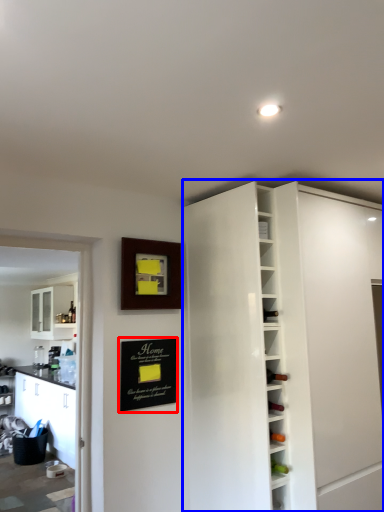
Question: Among these objects, which one is nearest to the camera, bulletin board (highlighted by a red box) or cabinetry (highlighted by a blue box)?

Choices:
 (A) bulletin board
 (B) cabinetry

Answer: (B)